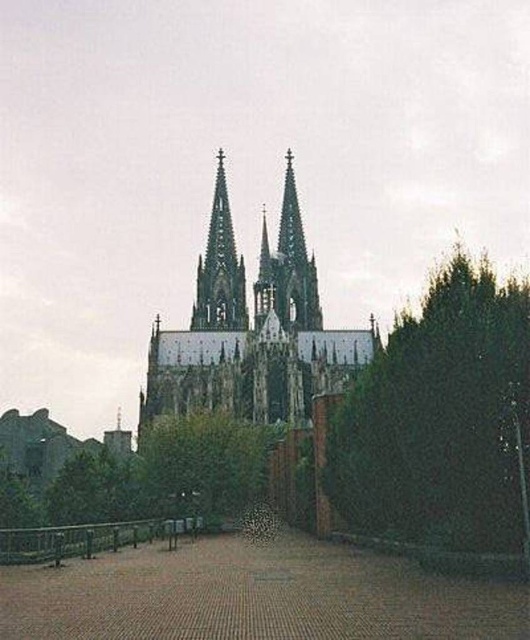
Question: Can you confirm if smooth gray spire at center is wider than smooth stone spire at center?

Choices:
 (A) yes
 (B) no

Answer: (A)

Question: Which object is closer to the camera taking this photo?

Choices:
 (A) stone gothic cathedral at center
 (B) green leafy tree at right
 (C) green leafy tree at center
 (D) smooth gray spire at center

Answer: (B)

Question: Estimate the real-world distances between objects in this image. Which object is closer to the green leafy tree at right?

Choices:
 (A) smooth gray spire at center
 (B) stone gothic cathedral at center
 (C) green leafy tree at center
 (D) smooth stone spire at center

Answer: (C)

Question: Does green leafy tree at right have a larger size compared to green leafy tree at center?

Choices:
 (A) yes
 (B) no

Answer: (A)

Question: In this image, where is green leafy tree at right located relative to smooth stone spire at center?

Choices:
 (A) left
 (B) right

Answer: (B)

Question: Which point is closer to the camera?

Choices:
 (A) smooth gray spire at center
 (B) green leafy tree at center
 (C) smooth stone spire at center

Answer: (B)